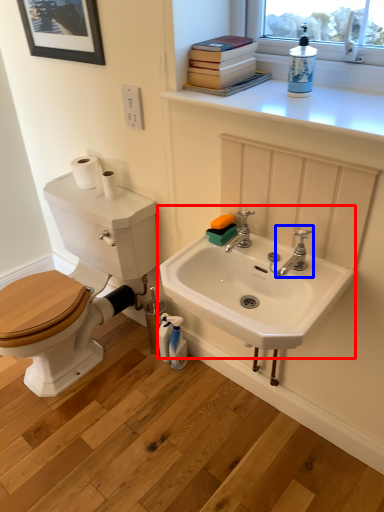
Question: Among these objects, which one is nearest to the camera, sink (highlighted by a red box) or tap (highlighted by a blue box)?

Choices:
 (A) sink
 (B) tap

Answer: (A)